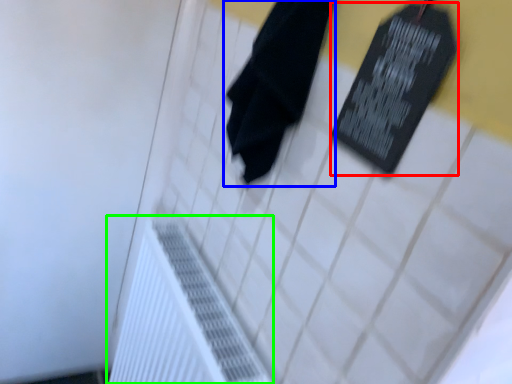
Question: Estimate the real-world distances between objects in this image. Which object is farther from bulletin board (highlighted by a red box), towel (highlighted by a blue box) or radiator (highlighted by a green box)?

Choices:
 (A) towel
 (B) radiator

Answer: (B)